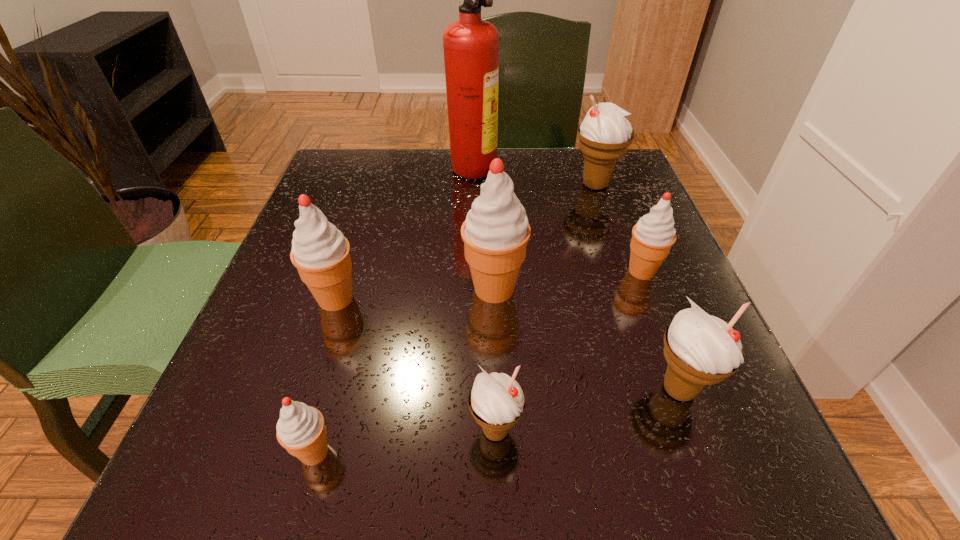
Choose which red icecream is the second nearest neighbor to the second red icecream from right to left. Please provide its 2D coordinates. Your answer should be formatted as a tuple, i.e. [(x, y)], where the tuple contains the x and y coordinates of a point satisfying the conditions above.

[(654, 234)]

Find the location of a particular element. the second closest red icecream to the farthest white icecream is located at coordinates (495, 233).

Identify which white icecream is located as the nearest to the second smallest white icecream. Please provide its 2D coordinates. Your answer should be formatted as a tuple, i.e. [(x, y)], where the tuple contains the x and y coordinates of a point satisfying the conditions above.

[(497, 401)]

At what (x,y) coordinates should I click in order to perform the action: click on white icecream that is the second closest one to the biggest white icecream. Please return your answer as a coordinate pair (x, y). The height and width of the screenshot is (540, 960). Looking at the image, I should click on (497, 401).

Find the location of a particular element. The image size is (960, 540). vacant region that satisfies the following two spatial constraints: 1. on the front-facing side of the tallest object; 2. on the left side of the smallest white icecream is located at coordinates (466, 430).

Where is `vacant point that satisfies the following two spatial constraints: 1. on the front-facing side of the red fire extinguisher; 2. on the back side of the third red icecream from left to right`? The width and height of the screenshot is (960, 540). vacant point that satisfies the following two spatial constraints: 1. on the front-facing side of the red fire extinguisher; 2. on the back side of the third red icecream from left to right is located at coordinates (469, 289).

Where is `vacant point that satisfies the following two spatial constraints: 1. on the front-facing side of the second biggest white icecream; 2. on the left side of the tallest object`? This screenshot has width=960, height=540. vacant point that satisfies the following two spatial constraints: 1. on the front-facing side of the second biggest white icecream; 2. on the left side of the tallest object is located at coordinates (467, 389).

What are the coordinates of `vacant space that satisfies the following two spatial constraints: 1. on the front-facing side of the red fire extinguisher; 2. on the right side of the rightmost red icecream` in the screenshot? It's located at (469, 271).

What are the coordinates of `vacant region that satisfies the following two spatial constraints: 1. on the front side of the rightmost red icecream; 2. on the right side of the farthest white icecream` in the screenshot? It's located at (625, 271).

The image size is (960, 540). I want to click on vacant position in the image that satisfies the following two spatial constraints: 1. on the front-facing side of the fire extinguisher; 2. on the right side of the farthest icecream, so click(x=472, y=185).